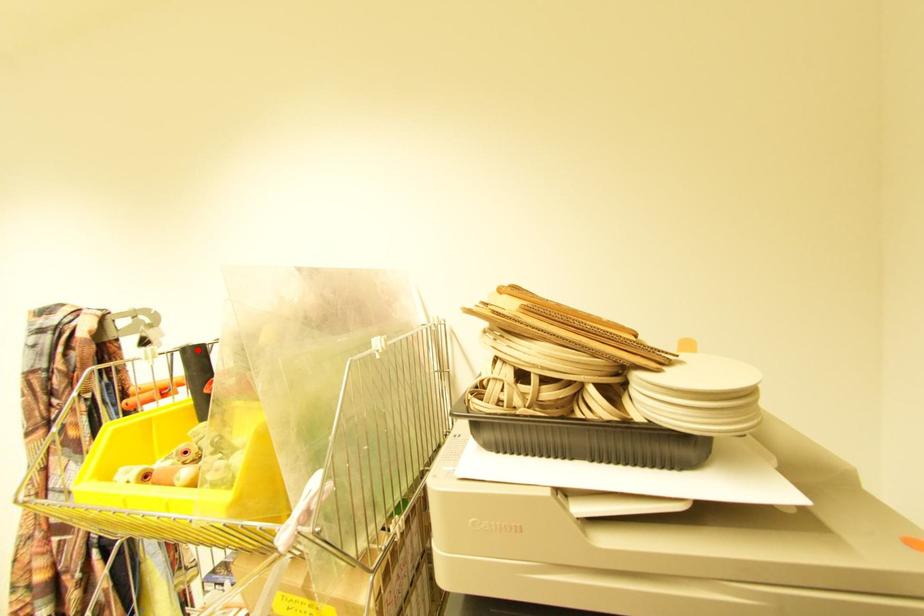
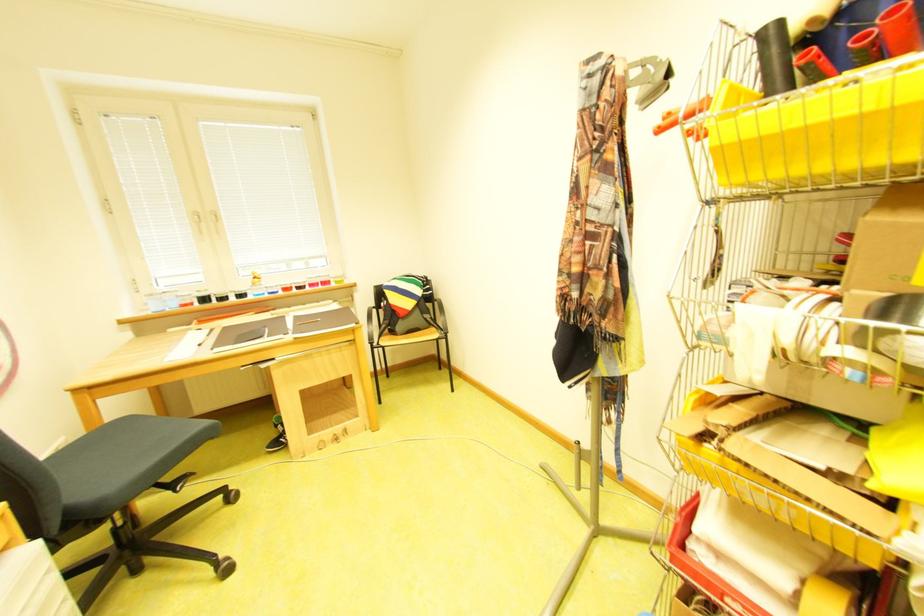
In the second image, find the point that corresponds to the highlighted location in the first image.

(775, 33)